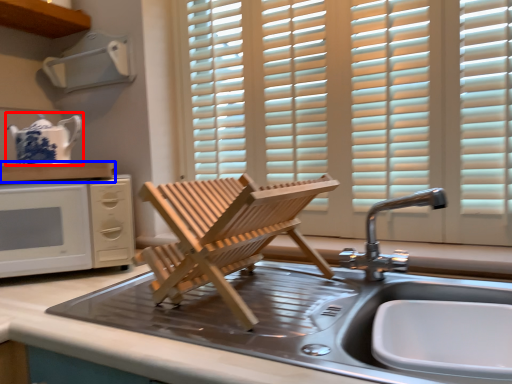
Question: Which point is closer to the camera, tea pot (highlighted by a red box) or countertop (highlighted by a blue box)?

Choices:
 (A) tea pot
 (B) countertop

Answer: (B)